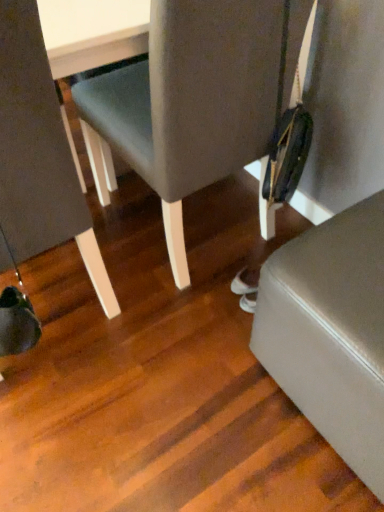
Question: From the image's perspective, is matte gray chair at left, the 2th chair in the right-to-left sequence, under satin silver knife at lower right?

Choices:
 (A) yes
 (B) no

Answer: (B)

Question: From the image's perspective, is matte gray chair at left, the 2th chair in the right-to-left sequence, on satin silver knife at lower right?

Choices:
 (A) no
 (B) yes

Answer: (B)

Question: Considering the relative sizes of matte gray chair at left, positioned as the first chair in left-to-right order, and satin silver knife at lower right in the image provided, is matte gray chair at left, positioned as the first chair in left-to-right order, taller than satin silver knife at lower right?

Choices:
 (A) no
 (B) yes

Answer: (B)

Question: Could satin silver knife at lower right be considered to be inside matte gray chair at left, positioned as the first chair in left-to-right order?

Choices:
 (A) yes
 (B) no

Answer: (B)

Question: Are matte gray chair at left, positioned as the first chair in left-to-right order, and satin silver knife at lower right located far from each other?

Choices:
 (A) no
 (B) yes

Answer: (A)

Question: Can you confirm if matte gray chair at left, the 2th chair in the right-to-left sequence, is thinner than satin silver knife at lower right?

Choices:
 (A) no
 (B) yes

Answer: (A)

Question: Considering the relative sizes of matte gray chair at center, the first chair positioned from the right, and satin silver knife at lower right in the image provided, is matte gray chair at center, the first chair positioned from the right, thinner than satin silver knife at lower right?

Choices:
 (A) yes
 (B) no

Answer: (B)

Question: Does matte gray chair at center, the 2th chair in the left-to-right sequence, appear on the left side of satin silver knife at lower right?

Choices:
 (A) no
 (B) yes

Answer: (B)

Question: Is matte gray chair at center, the first chair positioned from the right, closer to the viewer compared to satin silver knife at lower right?

Choices:
 (A) no
 (B) yes

Answer: (A)

Question: Is matte gray chair at center, the 2th chair in the left-to-right sequence, at the right side of satin silver knife at lower right?

Choices:
 (A) no
 (B) yes

Answer: (A)

Question: Can you confirm if matte gray chair at center, the 2th chair in the left-to-right sequence, is taller than satin silver knife at lower right?

Choices:
 (A) yes
 (B) no

Answer: (A)

Question: From the image's perspective, does matte gray chair at center, the 2th chair in the left-to-right sequence, appear lower than satin silver knife at lower right?

Choices:
 (A) yes
 (B) no

Answer: (B)

Question: Is matte gray chair at left, the 2th chair in the right-to-left sequence, located outside matte gray chair at center, the 2th chair in the left-to-right sequence?

Choices:
 (A) yes
 (B) no

Answer: (A)